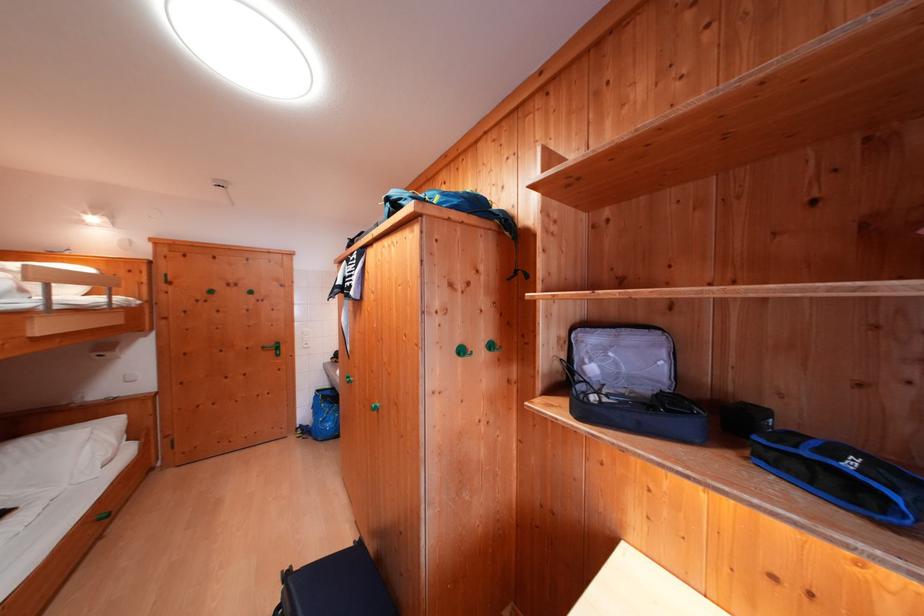
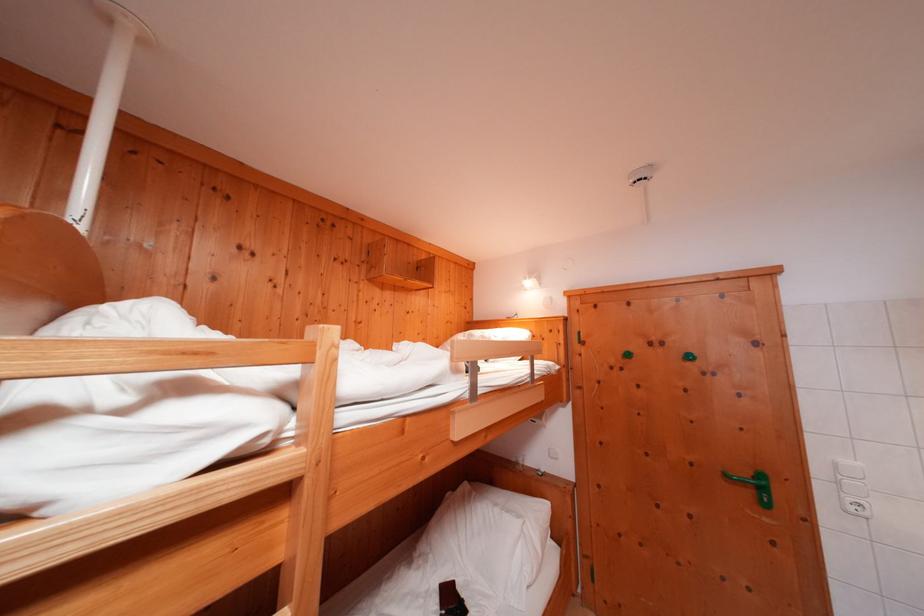
Where in the second image is the point corresponding to (285,353) from the first image?

(771, 493)